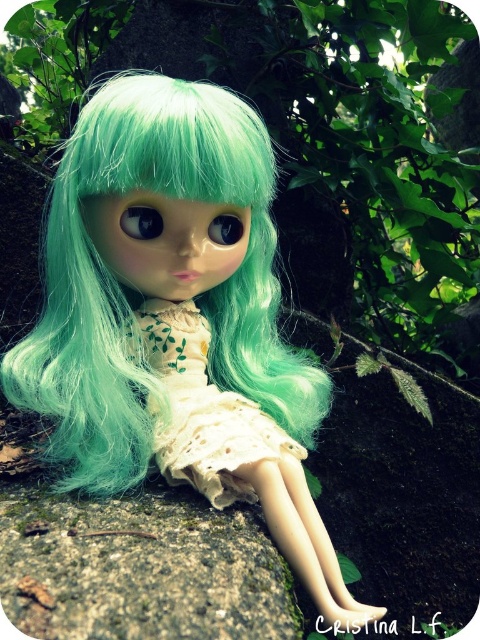
In the scene shown: Between green leafy tree at center and white lace dress at center, which one is positioned higher?

green leafy tree at center

Which is behind, point (215, 29) or point (165, 428)?

The point (215, 29) is more distant.

Who is more forward, (374, 88) or (286, 451)?

Point (286, 451)

Find the location of `green leafy tree at center`. green leafy tree at center is located at coordinates (311, 129).

Does matte green wig at center have a larger size compared to white lace dress at center?

Yes.

Between matte green wig at center and white lace dress at center, which one is positioned lower?

Positioned lower is white lace dress at center.

Image resolution: width=480 pixels, height=640 pixels. What do you see at coordinates (177, 320) in the screenshot? I see `matte green wig at center` at bounding box center [177, 320].

Identify the location of matte green wig at center. (177, 320).

Based on the photo, between matte green wig at center and green leafy tree at center, which one is positioned lower?

Positioned lower is matte green wig at center.

Who is taller, matte green wig at center or green leafy tree at center?

Standing taller between the two is green leafy tree at center.

Where is `matte green wig at center`? The image size is (480, 640). matte green wig at center is located at coordinates (177, 320).